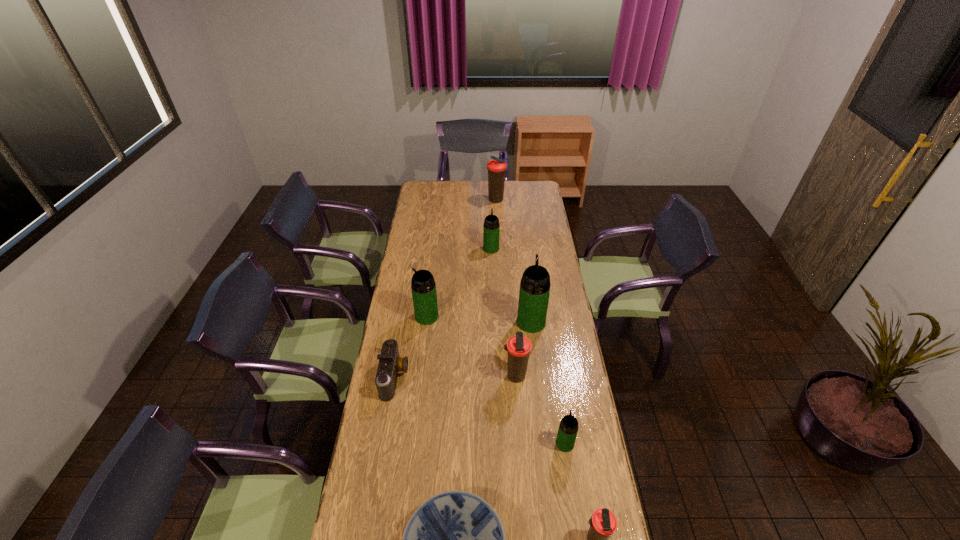
Where is `vacant area situated from the spout of the eighth nearest object`? This screenshot has height=540, width=960. vacant area situated from the spout of the eighth nearest object is located at coordinates (491, 217).

Locate an element on the screen. The width and height of the screenshot is (960, 540). free space located 0.390m on the left of the second nearest brown thermos bottle is located at coordinates (407, 376).

Find the location of a particular element. This screenshot has width=960, height=540. vacant space situated from the spout of the seventh farthest object is located at coordinates (554, 370).

Locate an element on the screen. This screenshot has width=960, height=540. vacant space located from the spout of the seventh farthest object is located at coordinates (561, 417).

This screenshot has height=540, width=960. I want to click on free location located 0.320m from the spout of the seventh farthest object, so click(553, 364).

This screenshot has height=540, width=960. In order to click on blank space located 0.070m on the lens of the camera in this screenshot , I will do `click(425, 376)`.

Identify the location of object that is at the far edge. Image resolution: width=960 pixels, height=540 pixels. (496, 168).

This screenshot has height=540, width=960. In order to click on thermos bottle at the left edge in this screenshot , I will do `click(423, 286)`.

I want to click on camera at the left edge, so click(390, 363).

In the image, there is a desktop. Where is `free region at the far edge`? The width and height of the screenshot is (960, 540). free region at the far edge is located at coordinates coord(446,188).